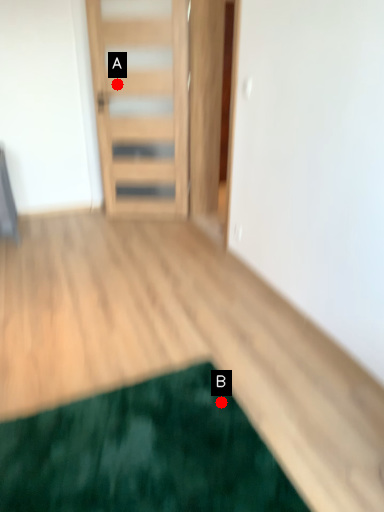
Question: Two points are circled on the image, labeled by A and B beside each circle. Which point is farther from the camera taking this photo?

Choices:
 (A) A is further
 (B) B is further

Answer: (A)